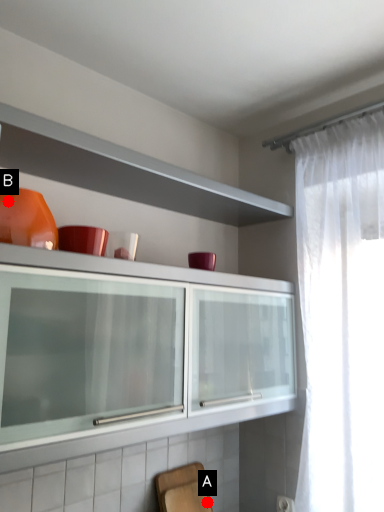
Question: Two points are circled on the image, labeled by A and B beside each circle. Which point appears farthest from the camera in this image?

Choices:
 (A) A is further
 (B) B is further

Answer: (A)